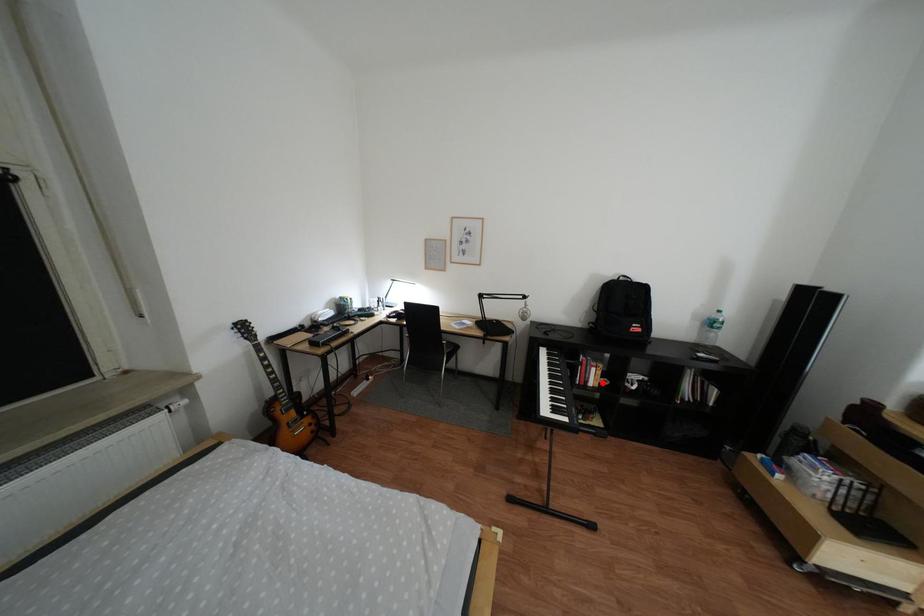
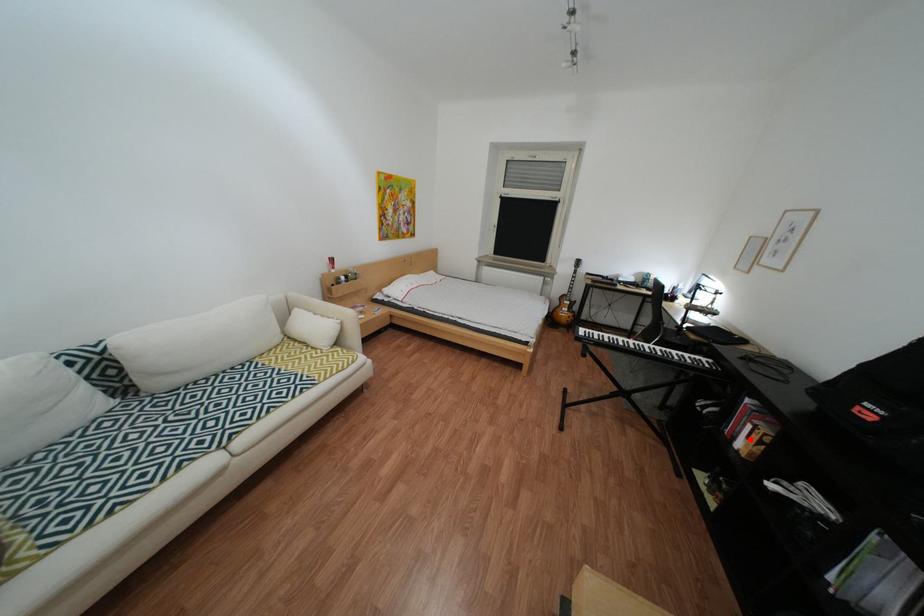
I am providing you with two images of the same scene from different viewpoints. A red point is marked on the first image and another point is marked on the second image. Do the highlighted points in image1 and image2 indicate the same real-world spot?

Yes